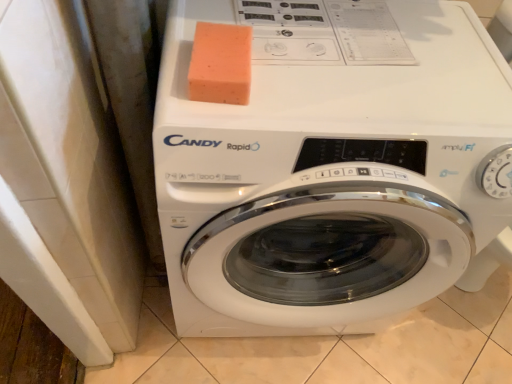
This screenshot has width=512, height=384. Identify the location of free spot in front of orange sponge at upper center. (212, 115).